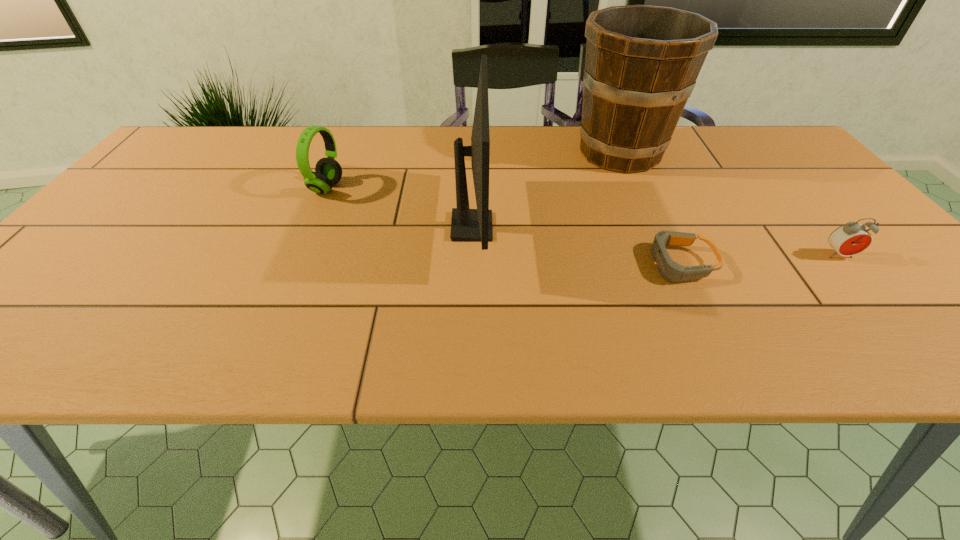
The image size is (960, 540). I want to click on the fourth closest object to the rightmost object, so click(x=328, y=171).

Find the location of `object that is the second closest to the rightmost object`. object that is the second closest to the rightmost object is located at coordinates (642, 62).

The height and width of the screenshot is (540, 960). What are the coordinates of `free location that satisfies the following two spatial constraints: 1. on the face of the second shortest object; 2. on the front and back of the goggles` in the screenshot? It's located at (846, 264).